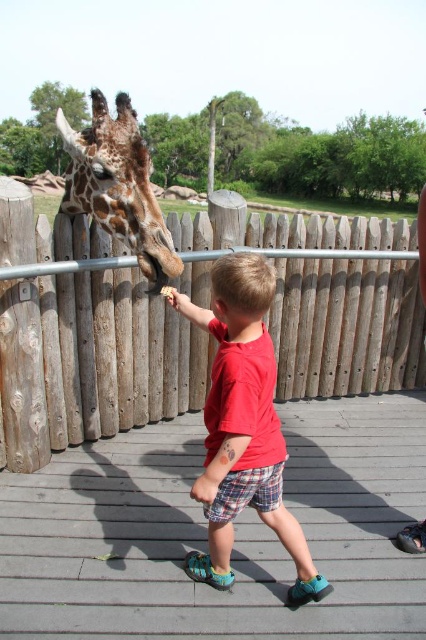
Can you confirm if wooden fence at center is positioned below red cotton shirt at center?

No, wooden fence at center is not below red cotton shirt at center.

Which of these two, wooden fence at center or red cotton shirt at center, stands shorter?

Standing shorter between the two is red cotton shirt at center.

Find the location of a particular element. The width and height of the screenshot is (426, 640). wooden fence at center is located at coordinates (86, 346).

Is red cotton shirt at center positioned behind spotted fur giraffe at center?

No.

Where is `red cotton shirt at center`? red cotton shirt at center is located at coordinates coord(242,426).

The width and height of the screenshot is (426, 640). I want to click on red cotton shirt at center, so click(242, 426).

Does wooden fence at center appear on the right side of spotted fur giraffe at center?

Yes, wooden fence at center is to the right of spotted fur giraffe at center.

How distant is wooden fence at center from spotted fur giraffe at center?

wooden fence at center and spotted fur giraffe at center are 33.08 inches apart from each other.

Does point (42, 248) come farther from viewer compared to point (74, 161)?

That is True.

Identify the location of wooden fence at center. This screenshot has height=640, width=426. (86, 346).